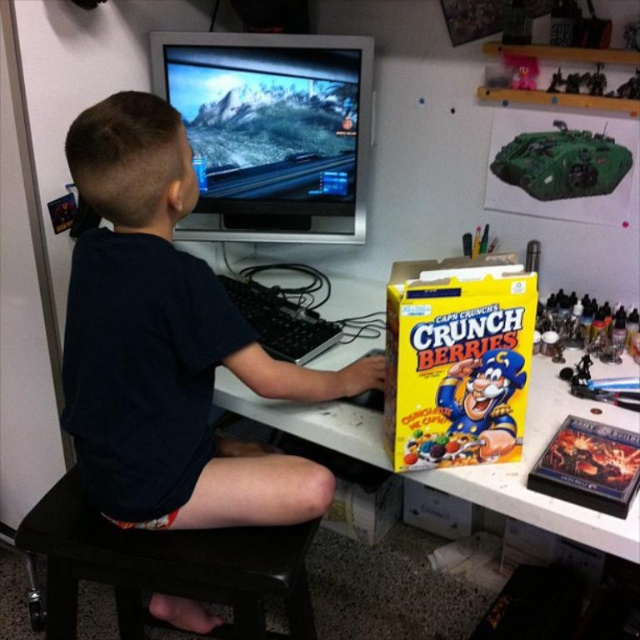
You are organizing the desk and need to place a new item between the yellow cardboard box at center and the green matte tank at upper right. Is there enough space between them to fit a standard notebook?

The yellow cardboard box at center is to the left of the green matte tank at upper right, so there is space between them. A standard notebook should fit between the yellow cardboard box at center and the green matte tank at upper right.

Based on the photo, you are a delivery person who needs to place a package between the black leather stool at lower center and the green matte tank at upper right. Based on their positions, where should you place the package?

The black leather stool at lower center is below the green matte tank at upper right, so you should place the package between them by positioning it above the black leather stool at lower center and below the green matte tank at upper right.

You are a delivery person who needs to place a new package on the desk. The package must be placed behind the yellow cardboard box at center but in front of the green matte tank at upper right. Is this possible?

The yellow cardboard box at center is in front of the green matte tank at upper right, so there is no space between them to place the package behind the yellow cardboard box at center but in front of the green matte tank at upper right. The package cannot be placed in that specific location.